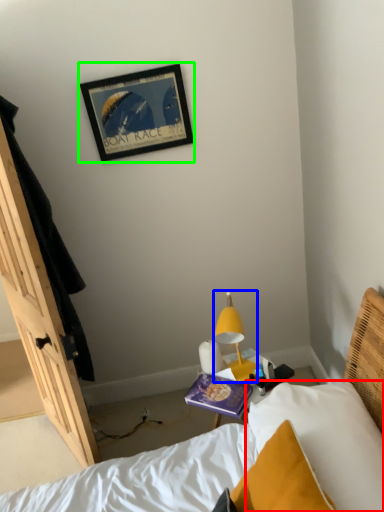
Question: Which is farther away from pillow (highlighted by a red box)? lamp (highlighted by a blue box) or picture frame (highlighted by a green box)?

Choices:
 (A) lamp
 (B) picture frame

Answer: (B)